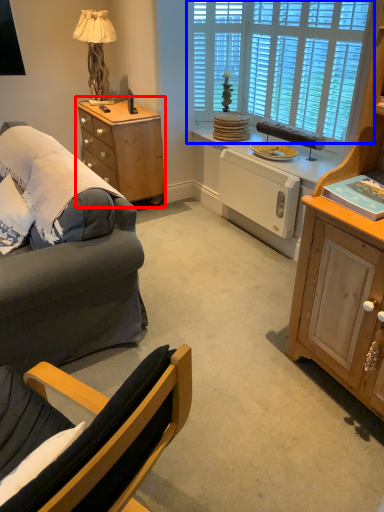
Question: Which of the following is the closest to the observer, table (highlighted by a red box) or window (highlighted by a blue box)?

Choices:
 (A) table
 (B) window

Answer: (B)